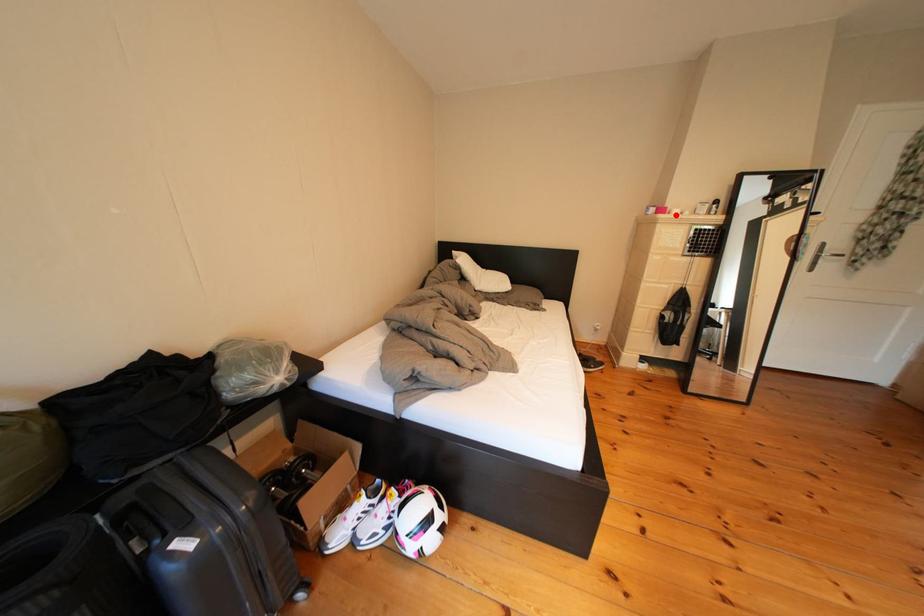
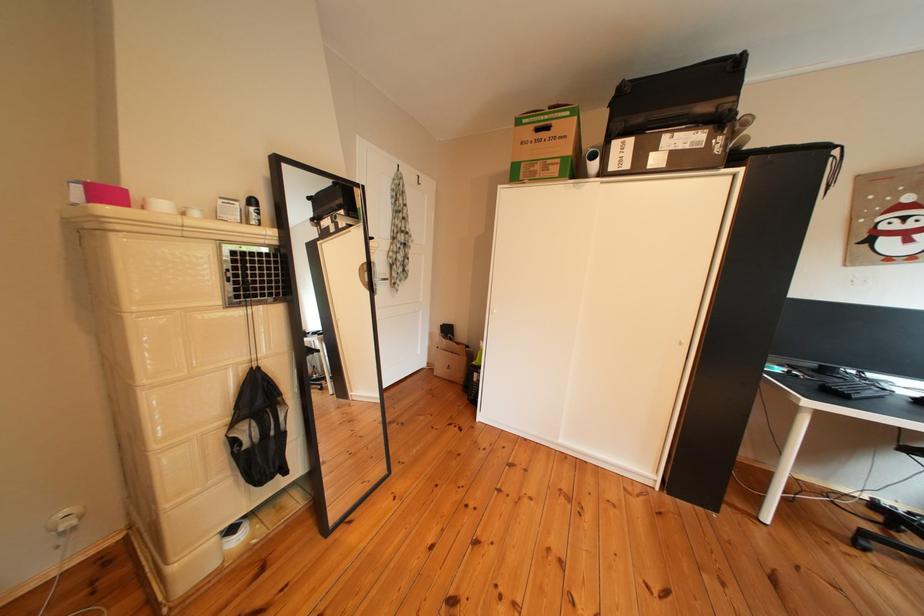
In the second image, find the point that corresponds to the highlighted location in the first image.

(123, 199)